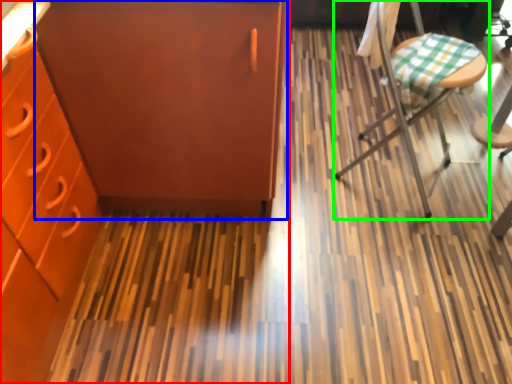
Question: Which is nearer to the cabinetry (highlighted by a red box)? file cabinet (highlighted by a blue box) or chair (highlighted by a green box).

Choices:
 (A) file cabinet
 (B) chair

Answer: (A)